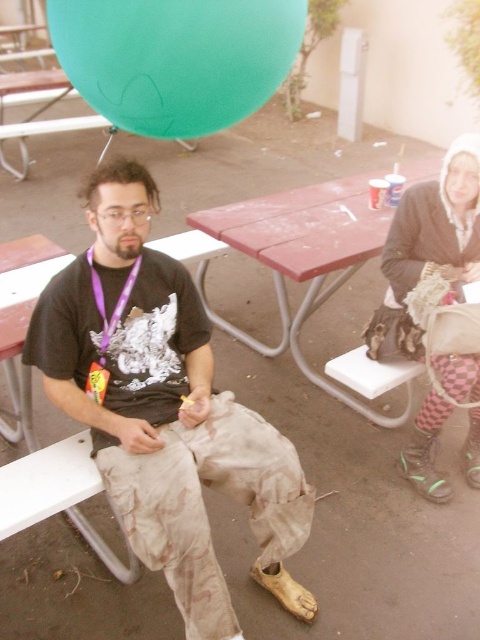
You are a person who is 1.7 meters tall. You want to place a 1.5 meter long ladder against the red plastic picnic table at center to reach something on a nearby tree. Is the distance between you and the picnic table sufficient to safely place the ladder at a 75 degree angle?

The red plastic picnic table at center and viewer are 2.22 meters apart. To safely place a 1.5 meter ladder at a 75 degree angle, the base of the ladder needs to be approximately 0.4 meters away from the picnic table. Since the distance between you and the picnic table is 2.22 meters, which is more than enough, you can safely place the ladder.